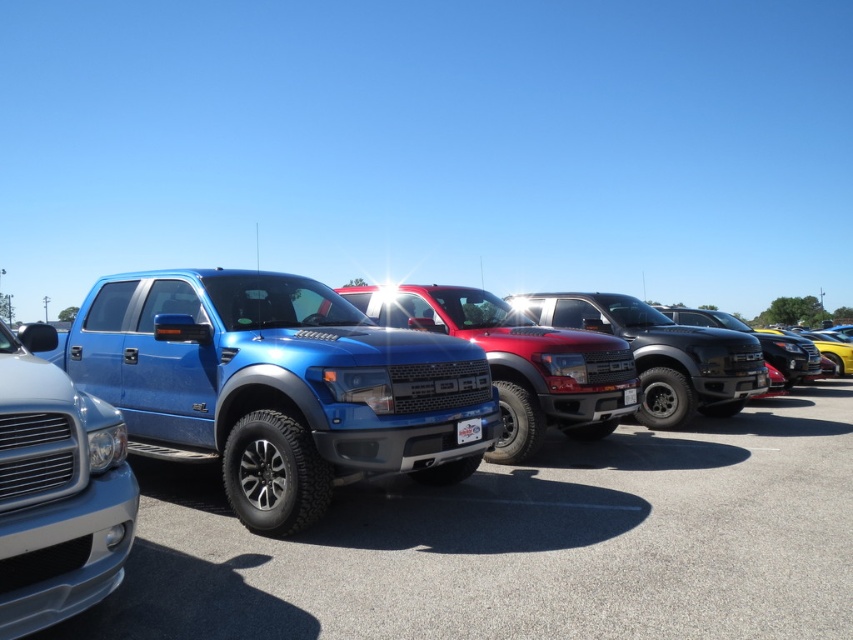
Question: Is metallic blue pickup truck at center to the right of satin silver truck at center from the viewer's perspective?

Choices:
 (A) no
 (B) yes

Answer: (B)

Question: Among these objects, which one is nearest to the camera?

Choices:
 (A) metallic blue pickup truck at center
 (B) shiny red truck at center

Answer: (A)

Question: Among these points, which one is farthest from the camera?

Choices:
 (A) (459, 352)
 (B) (534, 589)
 (C) (544, 353)
 (D) (9, 506)

Answer: (C)

Question: Which of the following is the closest to the observer?

Choices:
 (A) (354, 296)
 (B) (711, 472)

Answer: (B)

Question: Does brushed metal truck at center appear over satin silver truck at center?

Choices:
 (A) yes
 (B) no

Answer: (B)

Question: Is metallic blue pickup truck at center bigger than satin silver truck at center?

Choices:
 (A) yes
 (B) no

Answer: (A)